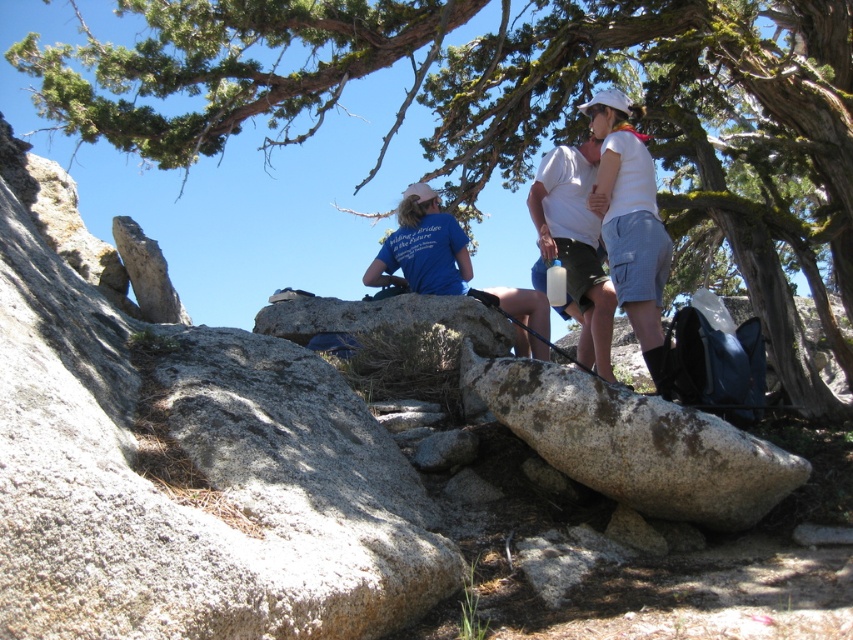
Question: Does white cotton shirt at center appear on the right side of blue fabric shirt at center?

Choices:
 (A) no
 (B) yes

Answer: (B)

Question: Is gray rough rock at center closer to the viewer compared to white matte shirt at upper center?

Choices:
 (A) no
 (B) yes

Answer: (A)

Question: Estimate the real-world distances between objects in this image. Which object is farther from the gray rough rock at center?

Choices:
 (A) white matte shirt at upper center
 (B) blue fabric shirt at center

Answer: (A)

Question: Which object is positioned closest to the green mossy tree at upper center?

Choices:
 (A) blue fabric shirt at center
 (B) white matte shirt at upper center
 (C) white cotton shirt at center
 (D) gray rough rock at center

Answer: (A)

Question: Considering the real-world distances, which object is farthest from the blue fabric shirt at center?

Choices:
 (A) green mossy tree at upper center
 (B) gray rough rock at center

Answer: (B)

Question: Does gray rough rock at center appear under green mossy tree at upper center?

Choices:
 (A) no
 (B) yes

Answer: (B)